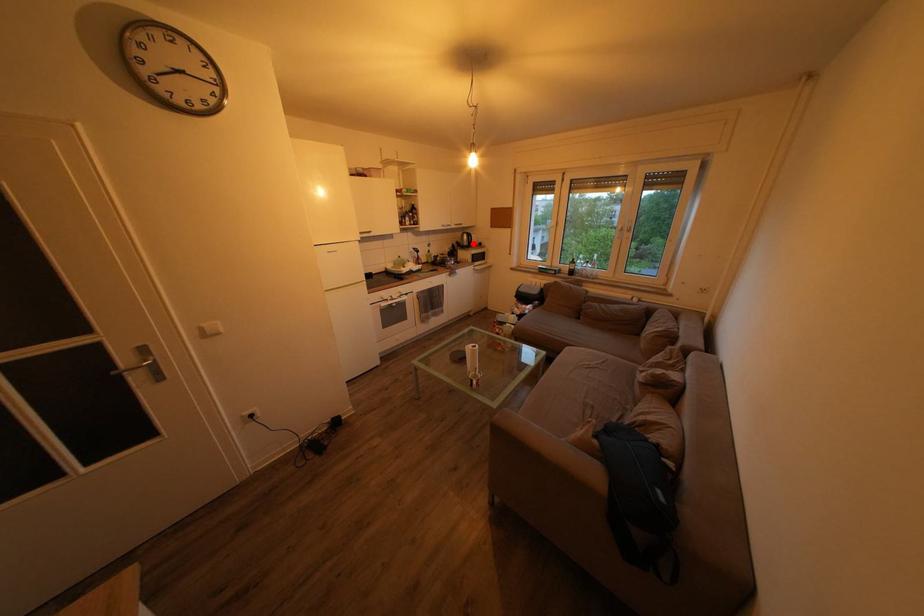
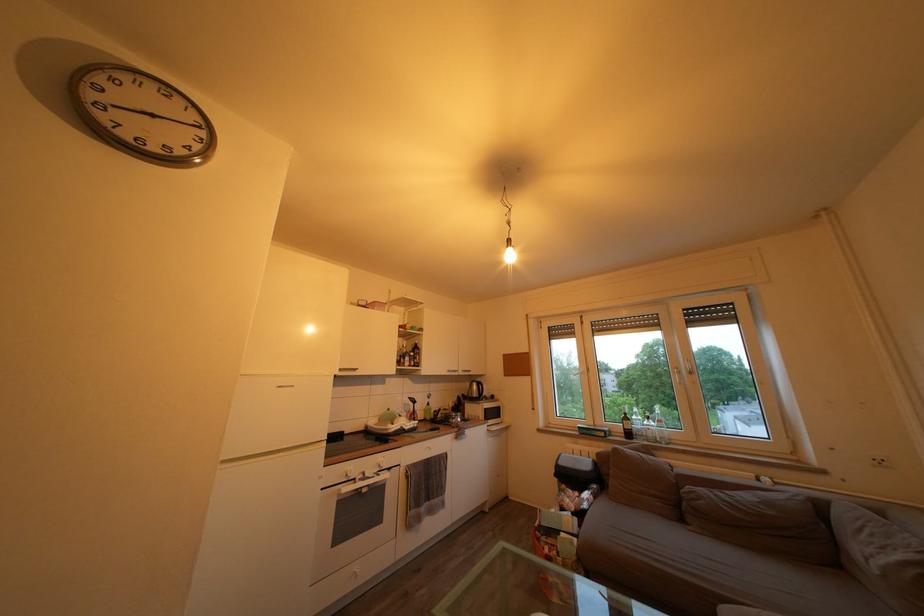
Question: I am providing you with two images of the same scene from different viewpoints. In image1, a red point is highlighted. Considering the same 3D point in image2, which of the following is correct?

Choices:
 (A) It is closer
 (B) It is farther

Answer: (B)